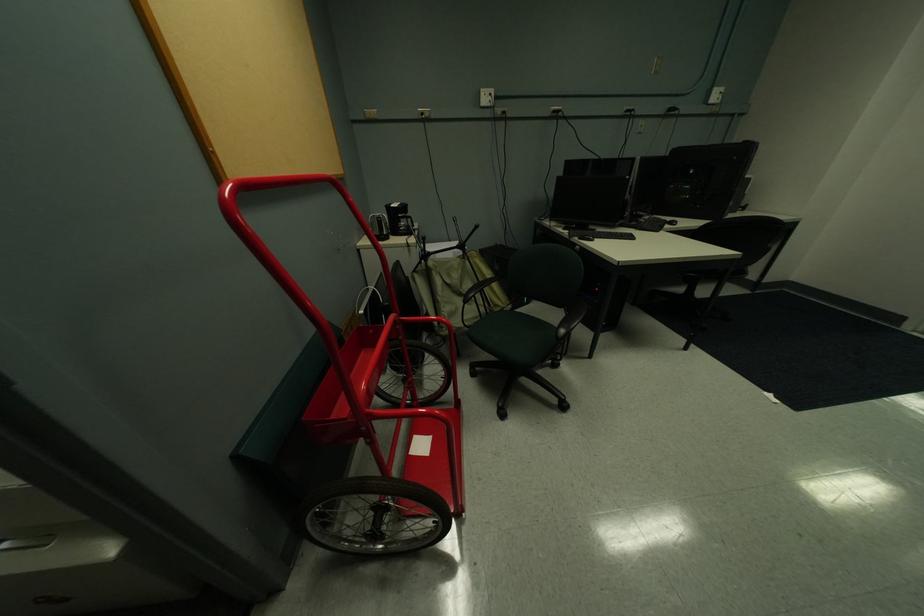
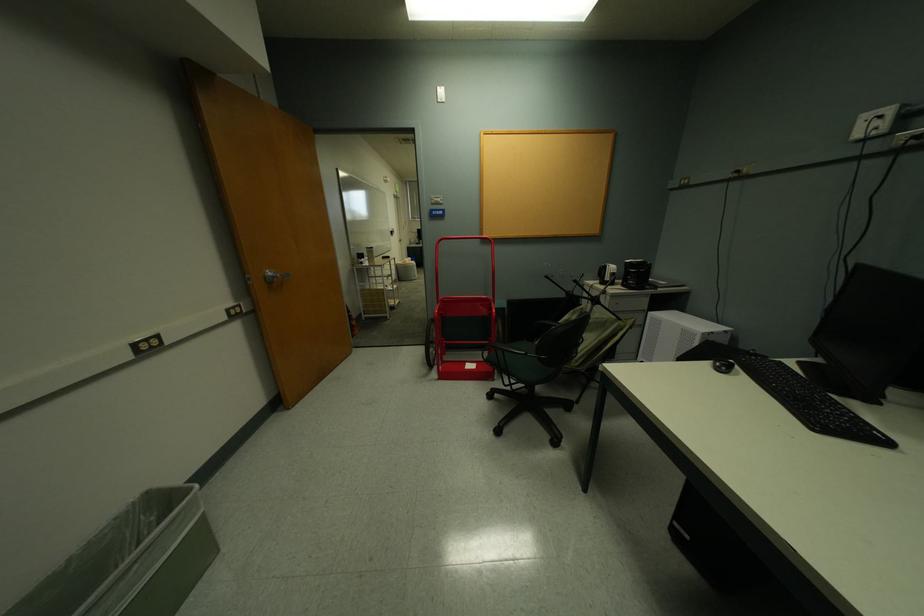
Question: I am providing you with two images of the same scene from different viewpoints. Please identify which objects are invisible in image2.

Choices:
 (A) grey trash can
 (B) red dolly handle
 (C) silver door handle
 (D) none of these

Answer: (D)